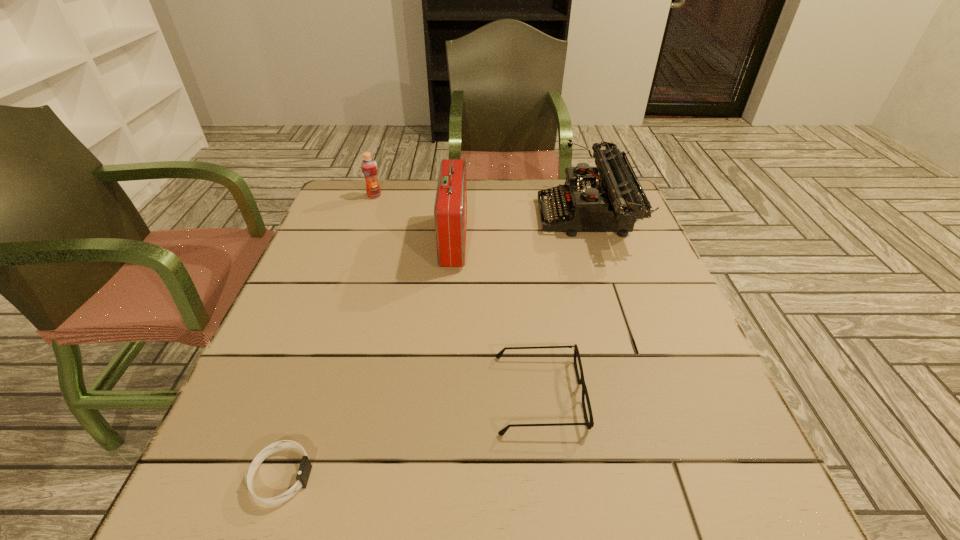
Where is `wristband located at the left edge`? wristband located at the left edge is located at coordinates (x=305, y=467).

You are a GUI agent. You are given a task and a screenshot of the screen. Output one action in this format:
    pyautogui.click(x=<x>, y=<y>)
    Task: Click on the object situated at the right edge
    
    Given the screenshot: What is the action you would take?
    pyautogui.click(x=612, y=202)

At what (x,y) coordinates should I click in order to perform the action: click on object located at the far left corner. Please return your answer as a coordinate pair (x, y). The height and width of the screenshot is (540, 960). Looking at the image, I should click on (369, 166).

The width and height of the screenshot is (960, 540). Identify the location of object positioned at the near left corner. (305, 467).

Identify the location of object positioned at the far right corner. (612, 202).

Locate an element on the screen. Image resolution: width=960 pixels, height=540 pixels. vacant space at the near edge is located at coordinates [524, 512].

Find the location of a particular element. This screenshot has height=540, width=960. free space at the left edge is located at coordinates (233, 457).

Where is `vacant space at the right edge of the desktop`? vacant space at the right edge of the desktop is located at coordinates (667, 454).

Identify the location of vacant space at the far left corner. This screenshot has width=960, height=540. (372, 211).

You are a GUI agent. You are given a task and a screenshot of the screen. Output one action in this format:
    pyautogui.click(x=<x>, y=<y>)
    Task: Click on the vacant region between the typewriter and the first-aid kit
    This screenshot has height=540, width=960.
    Given the screenshot: What is the action you would take?
    pyautogui.click(x=520, y=230)